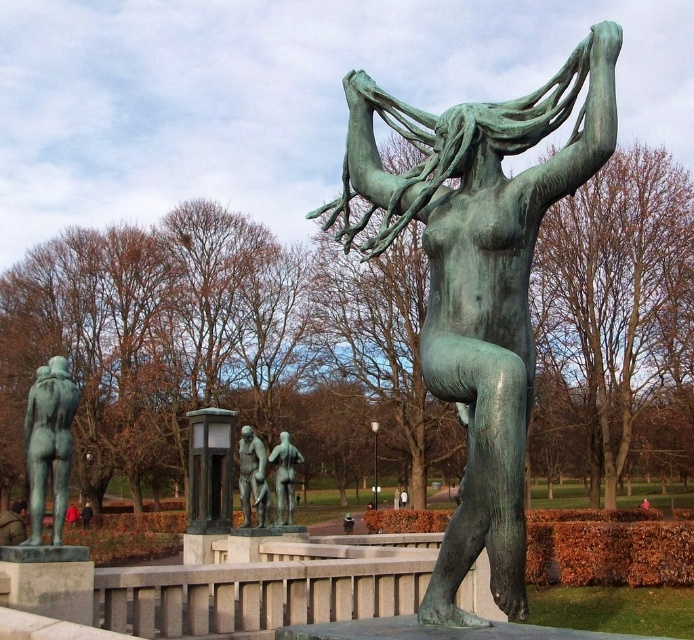
What do you see at coordinates (49, 444) in the screenshot? I see `green polished statue at left` at bounding box center [49, 444].

Does green polished statue at left come in front of bronze nude figure at center?

Yes, green polished statue at left is closer to the viewer.

Is point (51, 486) positioned in front of point (282, 513)?

Yes, it is in front of point (282, 513).

Locate an element on the screen. Image resolution: width=694 pixels, height=640 pixels. green polished statue at left is located at coordinates (49, 444).

Between bronze statue at center and bronze nude figure at center, which one has more height?

Standing taller between the two is bronze statue at center.

Does bronze statue at center have a lesser width compared to bronze nude figure at center?

Yes, bronze statue at center is thinner than bronze nude figure at center.

At what (x,y) coordinates should I click in order to perform the action: click on bronze statue at center. Please return your answer as a coordinate pair (x, y). This screenshot has width=694, height=640. Looking at the image, I should click on (253, 476).

In the scene shown: Does green patina bronze statue at center come behind brown leather jacket at lower left?

That is False.

Is green patina bronze statue at center bigger than brown leather jacket at lower left?

Actually, green patina bronze statue at center might be smaller than brown leather jacket at lower left.

Is point (536, 179) farther from camera compared to point (16, 536)?

No, it is in front of (16, 536).

The height and width of the screenshot is (640, 694). I want to click on green patina bronze statue at center, so click(x=480, y=282).